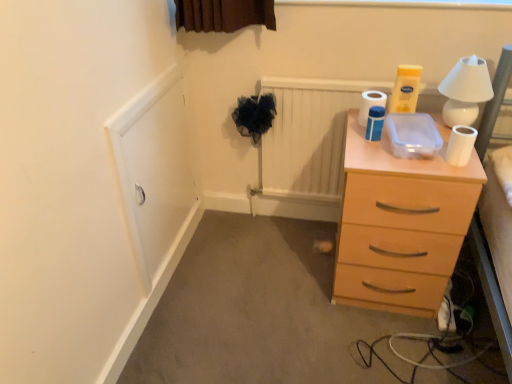
Question: Is white glossy toilet paper at upper right, acting as the second toilet paper starting from the right, inside or outside of white matte toilet paper at upper right, which ranks as the third toilet paper in left-to-right order?

Choices:
 (A) inside
 (B) outside

Answer: (B)

Question: In the image, is white glossy toilet paper at upper right, acting as the second toilet paper starting from the right, positioned in front of or behind white matte toilet paper at upper right, positioned as the 1th toilet paper in right-to-left order?

Choices:
 (A) front
 (B) behind

Answer: (B)

Question: Which of these objects is positioned farthest from the white matte toilet paper at upper right, the first toilet paper viewed from the front?

Choices:
 (A) white ceramic table lamp at upper right
 (B) white matte toilet paper at upper right, arranged as the second toilet paper when viewed from the front
 (C) white glossy toilet paper at upper right, acting as the second toilet paper starting from the right
 (D) light wood chest of drawers at right

Answer: (D)

Question: Estimate the real-world distances between objects in this image. Which object is farther from the white matte toilet paper at upper right, positioned as the 1th toilet paper in right-to-left order?

Choices:
 (A) white glossy toilet paper at upper right, the 1th toilet paper when ordered from back to front
 (B) white matte toilet paper at upper right, the 2th toilet paper from the back
 (C) white ceramic table lamp at upper right
 (D) light wood chest of drawers at right

Answer: (D)